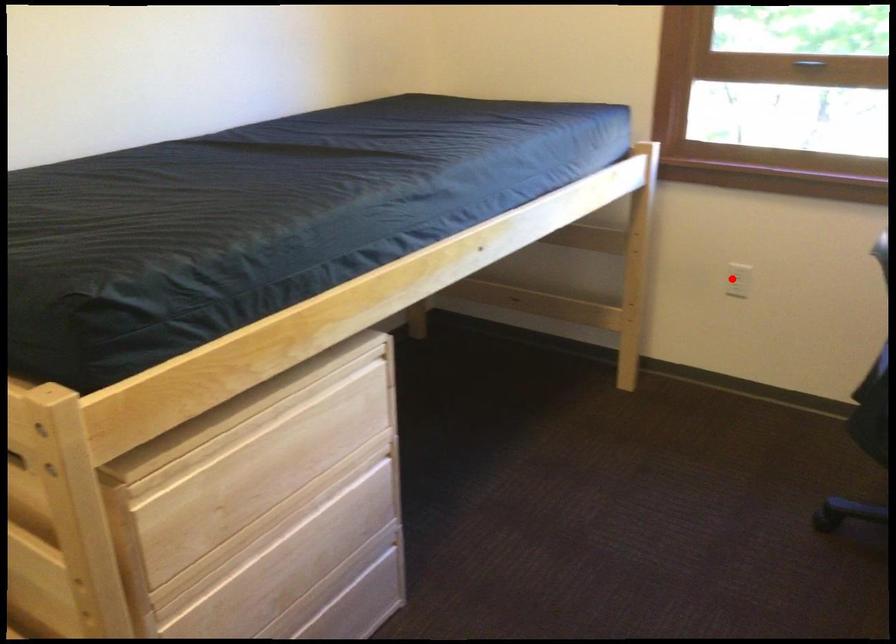
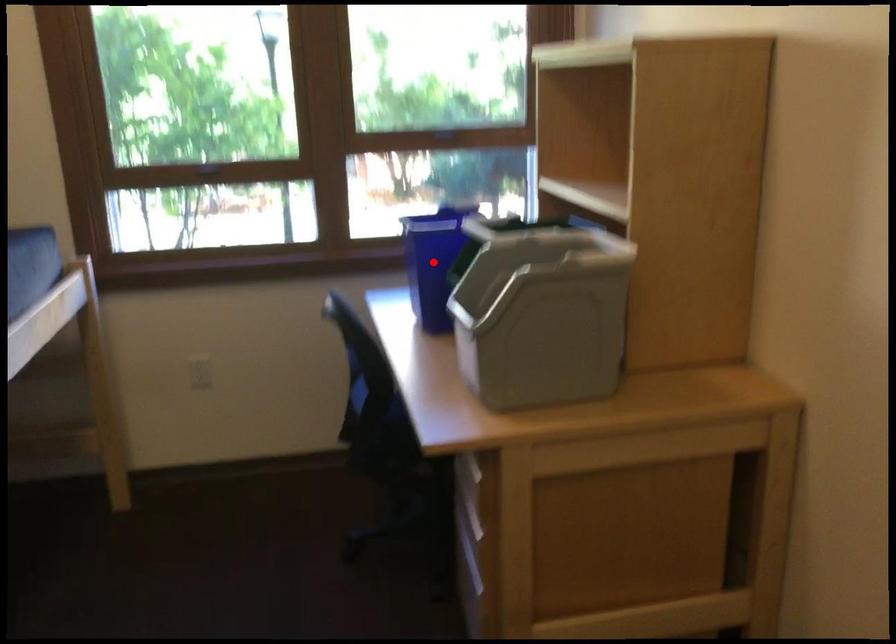
I am providing you with two images of the same scene from different viewpoints. A red point is marked on the first image and another point is marked on the second image. Are the points marked in image1 and image2 representing the same 3D position?

No